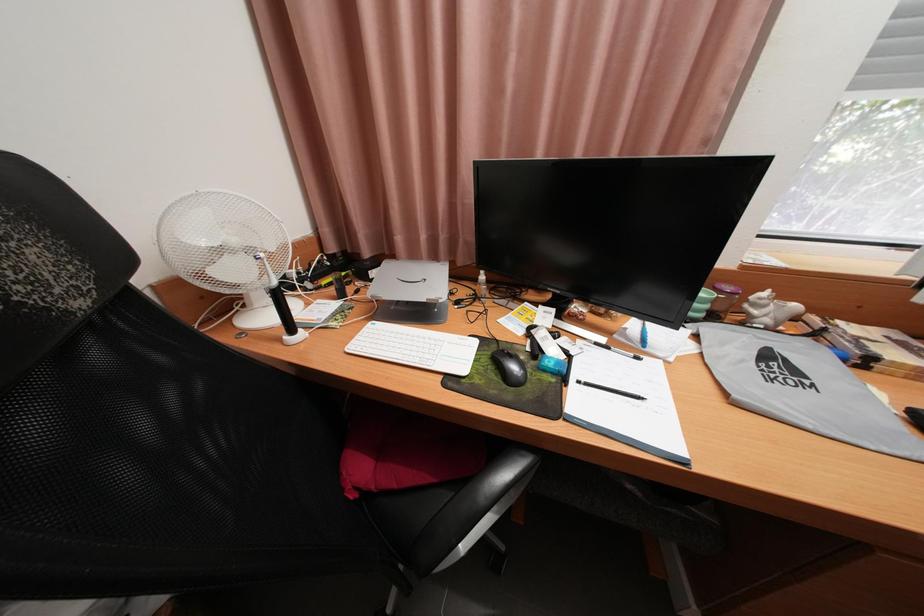
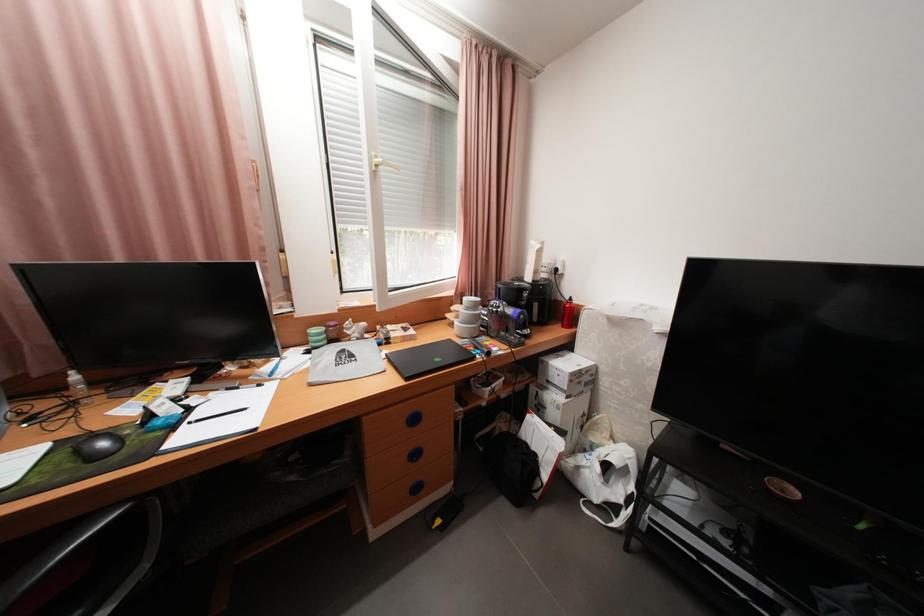
Question: How did the camera likely rotate?

Choices:
 (A) Left
 (B) Right
 (C) Up
 (D) Down

Answer: (B)